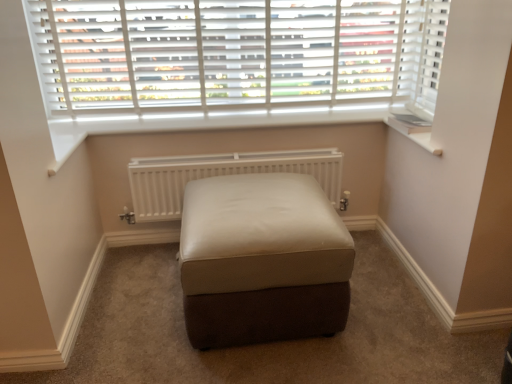
Question: Considering the relative sizes of white wood blinds at upper center and leather ottoman at center in the image provided, is white wood blinds at upper center taller than leather ottoman at center?

Choices:
 (A) yes
 (B) no

Answer: (A)

Question: Is white wood blinds at upper center to the left of leather ottoman at center from the viewer's perspective?

Choices:
 (A) yes
 (B) no

Answer: (A)

Question: Can you confirm if white wood blinds at upper center is thinner than leather ottoman at center?

Choices:
 (A) no
 (B) yes

Answer: (B)

Question: Is white wood blinds at upper center not inside leather ottoman at center?

Choices:
 (A) yes
 (B) no

Answer: (A)

Question: Is white wood blinds at upper center directly adjacent to leather ottoman at center?

Choices:
 (A) no
 (B) yes

Answer: (A)

Question: Is white wood blinds at upper center bigger than leather ottoman at center?

Choices:
 (A) yes
 (B) no

Answer: (B)

Question: Considering the relative sizes of leather ottoman at center and white plastic window sill at upper right in the image provided, is leather ottoman at center wider than white plastic window sill at upper right?

Choices:
 (A) yes
 (B) no

Answer: (A)

Question: Does leather ottoman at center turn towards white plastic window sill at upper right?

Choices:
 (A) no
 (B) yes

Answer: (A)

Question: Does leather ottoman at center appear on the right side of white plastic window sill at upper right?

Choices:
 (A) yes
 (B) no

Answer: (B)

Question: Is leather ottoman at center beside white plastic window sill at upper right?

Choices:
 (A) no
 (B) yes

Answer: (A)

Question: From a real-world perspective, is leather ottoman at center positioned under white plastic window sill at upper right based on gravity?

Choices:
 (A) yes
 (B) no

Answer: (A)

Question: Considering the relative positions of leather ottoman at center and white plastic window sill at upper right in the image provided, is leather ottoman at center to the left of white plastic window sill at upper right from the viewer's perspective?

Choices:
 (A) no
 (B) yes

Answer: (B)

Question: From a real-world perspective, is white matte radiator at center below leather ottoman at center?

Choices:
 (A) yes
 (B) no

Answer: (B)